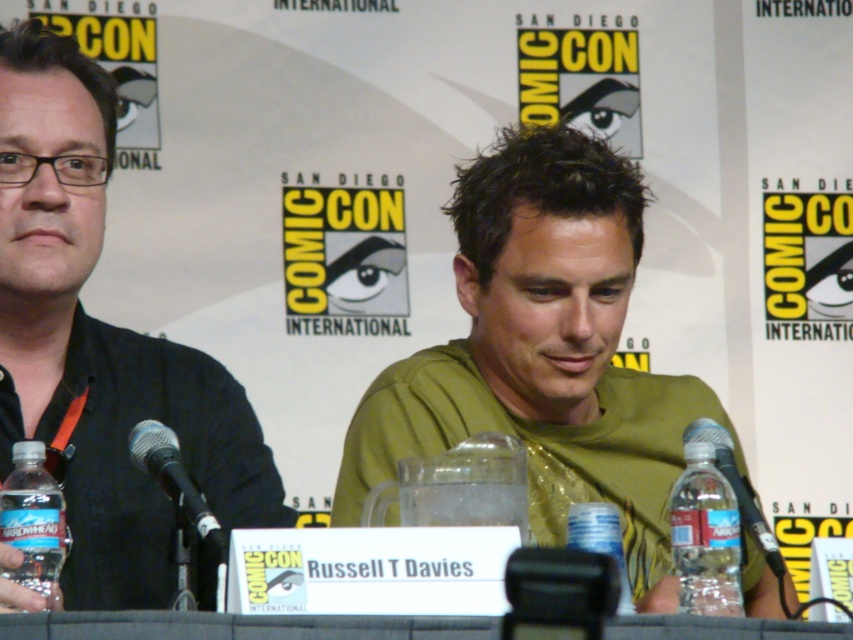
Question: Among these objects, which one is nearest to the camera?

Choices:
 (A) clear plastic bottle at lower right
 (B) black matte shirt at left
 (C) green matte t-shirt at center
 (D) transparent plastic table at center

Answer: (D)

Question: Which object is farther from the camera taking this photo?

Choices:
 (A) clear plastic bottle at lower right
 (B) green matte t-shirt at center
 (C) clear plastic bottle at center

Answer: (B)

Question: Can you confirm if black matte shirt at left is positioned to the right of clear plastic bottle at center?

Choices:
 (A) yes
 (B) no

Answer: (B)

Question: Is green matte t-shirt at center behind clear plastic water bottle at lower left?

Choices:
 (A) yes
 (B) no

Answer: (A)

Question: Is clear plastic bottle at lower right smaller than black plastic microphone at right?

Choices:
 (A) yes
 (B) no

Answer: (A)

Question: Among these points, which one is nearest to the camera?

Choices:
 (A) (26, 586)
 (B) (682, 627)
 (C) (169, 477)
 (D) (511, 333)

Answer: (B)